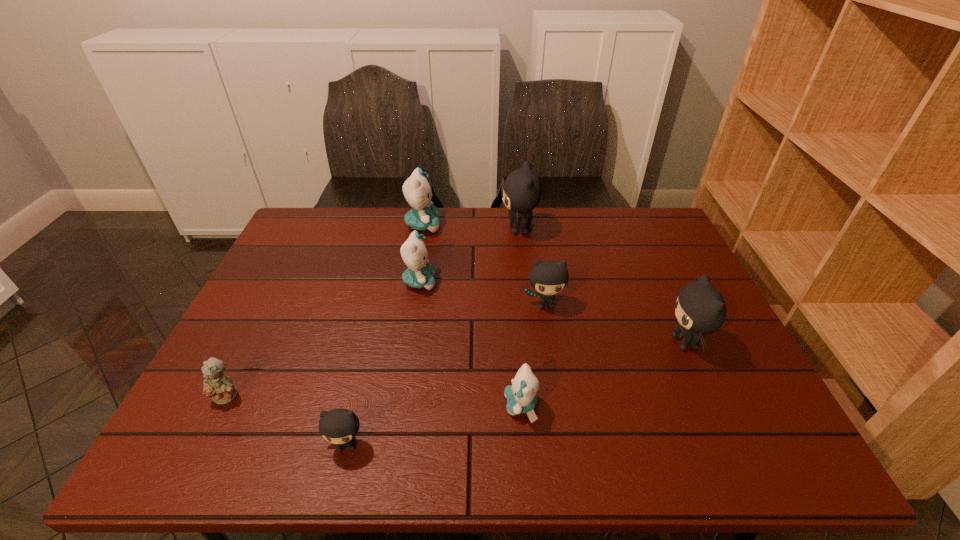
Where is `vacant space that satisfies the following two spatial constraints: 1. on the face of the biggest blue kitten; 2. on the front-facing side of the nearest object`? vacant space that satisfies the following two spatial constraints: 1. on the face of the biggest blue kitten; 2. on the front-facing side of the nearest object is located at coordinates (386, 445).

Where is `free spot that satisfies the following two spatial constraints: 1. on the face of the second nearest blue kitten; 2. on the front-facing side of the nearest kitten`? The width and height of the screenshot is (960, 540). free spot that satisfies the following two spatial constraints: 1. on the face of the second nearest blue kitten; 2. on the front-facing side of the nearest kitten is located at coordinates (395, 445).

You are a GUI agent. You are given a task and a screenshot of the screen. Output one action in this format:
    pyautogui.click(x=<x>, y=<y>)
    Task: Click on the free space that satisfies the following two spatial constraints: 1. on the face of the biggest blue kitten; 2. on the front-facing side of the leftmost gray kitten
    The height and width of the screenshot is (540, 960).
    Given the screenshot: What is the action you would take?
    pyautogui.click(x=386, y=445)